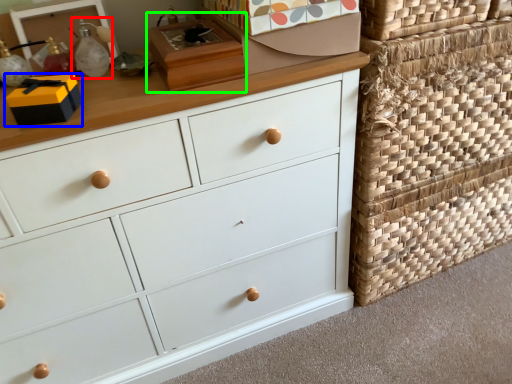
Question: Which object is the closest to the toy (highlighted by a red box)? Choose among these: storage box (highlighted by a blue box) or shoe box (highlighted by a green box).

Choices:
 (A) storage box
 (B) shoe box

Answer: (A)